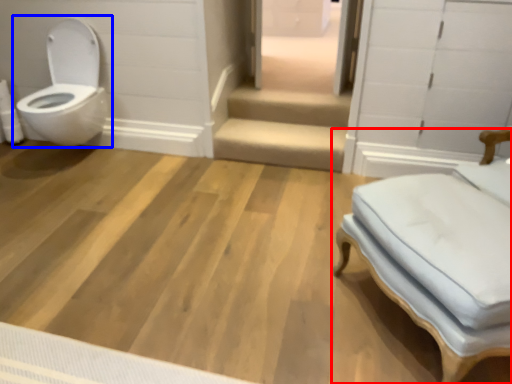
Question: Among these objects, which one is nearest to the camera, furniture (highlighted by a red box) or toilet (highlighted by a blue box)?

Choices:
 (A) furniture
 (B) toilet

Answer: (A)